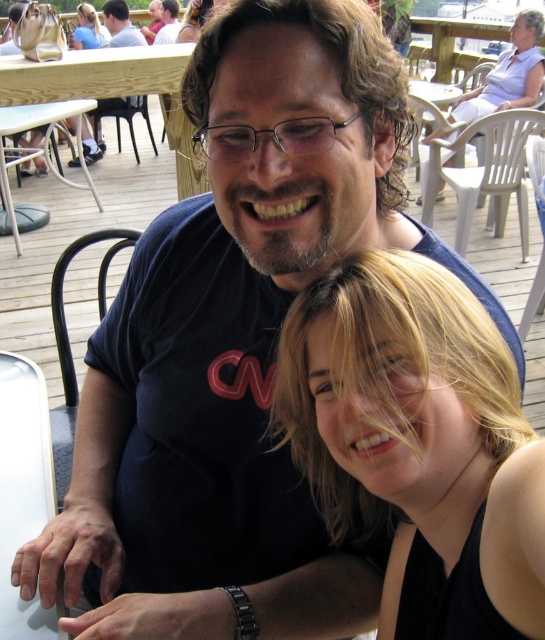
Who is positioned more to the right, wooden picnic table at upper left or white plastic table at lower left?

wooden picnic table at upper left

Can you confirm if wooden picnic table at upper left is positioned to the left of white plastic table at lower left?

In fact, wooden picnic table at upper left is to the right of white plastic table at lower left.

Between point (118, 49) and point (16, 129), which one is positioned in front?

Point (118, 49) is more forward.

Identify the location of wooden picnic table at upper left. The image size is (545, 640). (93, 74).

Does point (423, 499) lie behind point (7, 92)?

No, (423, 499) is in front of (7, 92).

Find the location of `blonde hair at lower right`. blonde hair at lower right is located at coordinates (403, 426).

Which is above, white plastic table at lower left or blonde hair at upper center?

blonde hair at upper center

Who is positioned more to the right, white plastic table at lower left or blonde hair at upper center?

blonde hair at upper center is more to the right.

The image size is (545, 640). I want to click on white plastic table at lower left, so [41, 147].